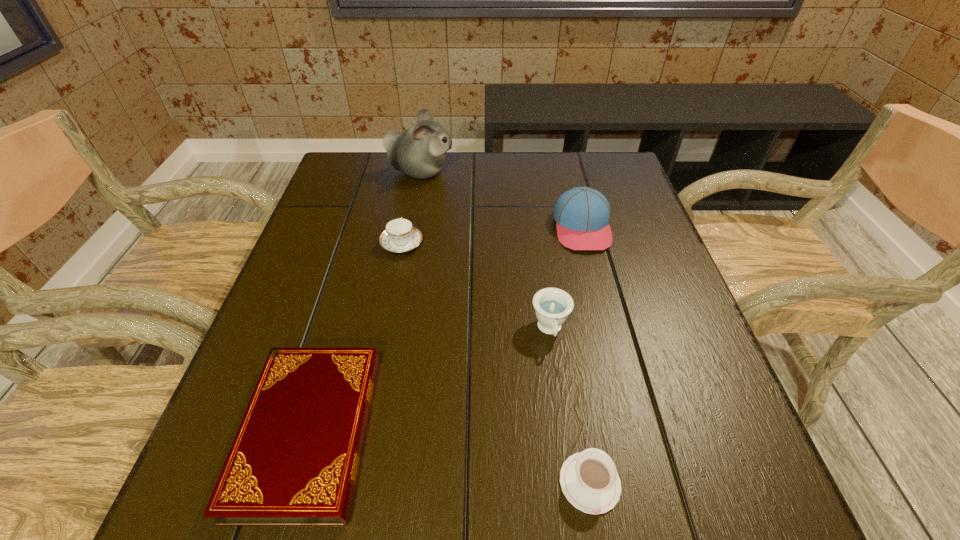
Find the location of a particular element. free spot between the nearest teacup and the baseball cap is located at coordinates (586, 355).

Where is `free space that is in between the hamster and the shortest object`? Image resolution: width=960 pixels, height=540 pixels. free space that is in between the hamster and the shortest object is located at coordinates (365, 302).

Locate an element on the screen. The image size is (960, 540). free area in between the third nearest object and the baseball cap is located at coordinates (566, 279).

This screenshot has height=540, width=960. What are the coordinates of `vacant area between the nearest teacup and the shortest object` in the screenshot? It's located at (449, 457).

Identify the location of vacant point located between the hardback book and the tallest teacup. This screenshot has width=960, height=540. (429, 381).

The width and height of the screenshot is (960, 540). In order to click on free area in between the fourth shortest object and the leftmost teacup in this screenshot , I will do `click(476, 287)`.

Locate an element on the screen. free space between the nearest teacup and the second tallest object is located at coordinates (586, 355).

The width and height of the screenshot is (960, 540). In order to click on vacant point located between the farthest teacup and the nearest teacup in this screenshot , I will do `click(495, 363)`.

This screenshot has width=960, height=540. I want to click on unoccupied area between the second farthest teacup and the nearest teacup, so click(570, 406).

The image size is (960, 540). Find the location of `unoccupied position between the nearest teacup and the tallest teacup`. unoccupied position between the nearest teacup and the tallest teacup is located at coordinates (570, 406).